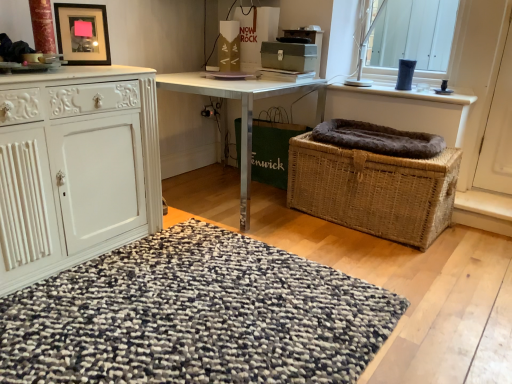
You are a GUI agent. You are given a task and a screenshot of the screen. Output one action in this format:
    pyautogui.click(x=<x>, y=<y>)
    Task: Click on the woven brown picnic basket at lower right
    The width and height of the screenshot is (512, 384).
    Given the screenshot: What is the action you would take?
    pyautogui.click(x=373, y=190)

Where is `woven brown picnic basket at lower right`? Image resolution: width=512 pixels, height=384 pixels. woven brown picnic basket at lower right is located at coordinates (373, 190).

Considering the positions of objects woven brown basket at center and woven brown picnic basket at lower right in the image provided, who is more to the right, woven brown basket at center or woven brown picnic basket at lower right?

woven brown picnic basket at lower right is more to the right.

Considering the positions of point (286, 169) and point (358, 165), is point (286, 169) closer or farther from the camera than point (358, 165)?

Point (286, 169) appears to be farther away from the viewer than point (358, 165).

In the scene shown: From the image's perspective, between woven brown basket at center and woven brown picnic basket at lower right, who is located below?

woven brown picnic basket at lower right, from the image's perspective.

Which of these two, woven brown basket at center or woven brown picnic basket at lower right, stands taller?

woven brown basket at center.

Consider the image. Could you tell me if metallic silver desk at center is facing woven brown picnic basket at lower right?

No, metallic silver desk at center is not turned towards woven brown picnic basket at lower right.

Which point is more forward, (x=246, y=107) or (x=441, y=206)?

Point (x=441, y=206)

Locate an element on the screen. desk that is above the woven brown picnic basket at lower right (from a real-world perspective) is located at coordinates (242, 111).

Does metallic silver desk at center appear on the right side of woven brown picnic basket at lower right?

Incorrect, metallic silver desk at center is not on the right side of woven brown picnic basket at lower right.

In terms of size, does metallic silver desk at center appear bigger or smaller than matte black picture frame at upper left?

Clearly, metallic silver desk at center is larger in size than matte black picture frame at upper left.

I want to click on picture frame above the metallic silver desk at center (from the image's perspective), so click(x=82, y=33).

Which of these two, metallic silver desk at center or matte black picture frame at upper left, stands taller?

metallic silver desk at center.

Which object is positioned more to the left, metallic silver desk at center or textured woolen rug at center?

Positioned to the left is textured woolen rug at center.

Is metallic silver desk at center surrounding textured woolen rug at center?

That's incorrect, textured woolen rug at center is not inside metallic silver desk at center.

From the image's perspective, is metallic silver desk at center under textured woolen rug at center?

Actually, metallic silver desk at center appears above textured woolen rug at center in the image.

Considering the relative sizes of metallic silver desk at center and textured woolen rug at center in the image provided, is metallic silver desk at center taller than textured woolen rug at center?

Indeed, metallic silver desk at center has a greater height compared to textured woolen rug at center.

Considering the relative sizes of woven brown picnic basket at lower right and matte black picture frame at upper left in the image provided, is woven brown picnic basket at lower right smaller than matte black picture frame at upper left?

Actually, woven brown picnic basket at lower right might be larger than matte black picture frame at upper left.

Locate an element on the screen. This screenshot has width=512, height=384. picnic basket below the matte black picture frame at upper left (from a real-world perspective) is located at coordinates (373, 190).

Is woven brown picnic basket at lower right oriented away from matte black picture frame at upper left?

No, woven brown picnic basket at lower right is not facing away from matte black picture frame at upper left.

How far apart are woven brown picnic basket at lower right and matte black picture frame at upper left?

A distance of 1.39 meters exists between woven brown picnic basket at lower right and matte black picture frame at upper left.

Is matte black picture frame at upper left beside woven brown basket at center?

No, matte black picture frame at upper left is not making contact with woven brown basket at center.

How different are the orientations of matte black picture frame at upper left and woven brown basket at center in degrees?

The facing directions of matte black picture frame at upper left and woven brown basket at center are 52.8 degrees apart.

Considering the sizes of objects matte black picture frame at upper left and woven brown basket at center in the image provided, who is thinner, matte black picture frame at upper left or woven brown basket at center?

matte black picture frame at upper left.

Could you tell me if matte black picture frame at upper left is facing woven brown basket at center?

No, matte black picture frame at upper left is not aimed at woven brown basket at center.

From the picture: Is white carved cabinet at left at the back of metallic silver desk at center?

No, metallic silver desk at center's orientation is not away from white carved cabinet at left.

In terms of width, does metallic silver desk at center look wider or thinner when compared to white carved cabinet at left?

Considering their sizes, metallic silver desk at center looks broader than white carved cabinet at left.

From a real-world perspective, who is located higher, metallic silver desk at center or white carved cabinet at left?

From a 3D spatial view, white carved cabinet at left is above.

Who is smaller, metallic silver desk at center or white carved cabinet at left?

With smaller size is white carved cabinet at left.

This screenshot has width=512, height=384. I want to click on picnic basket in front of the woven brown basket at center, so click(x=373, y=190).

Where is `picnic basket on the right side of metallic silver desk at center`? picnic basket on the right side of metallic silver desk at center is located at coordinates (373, 190).

Considering their positions, is matte black picture frame at upper left positioned further to woven brown basket at center than metallic silver desk at center?

matte black picture frame at upper left is further to woven brown basket at center.

Based on their spatial positions, is matte black picture frame at upper left or white carved cabinet at left closer to textured woolen rug at center?

white carved cabinet at left is closer to textured woolen rug at center.

Which object lies nearer to the anchor point white carved cabinet at left, textured woolen rug at center or metallic silver desk at center?

textured woolen rug at center.

Looking at the image, which one is located closer to white carved cabinet at left, matte black picture frame at upper left or textured woolen rug at center?

The object closer to white carved cabinet at left is textured woolen rug at center.

Estimate the real-world distances between objects in this image. Which object is further from matte black picture frame at upper left, white carved cabinet at left or woven brown picnic basket at lower right?

The object further to matte black picture frame at upper left is woven brown picnic basket at lower right.

When comparing their distances from woven brown picnic basket at lower right, does white carved cabinet at left or textured woolen rug at center seem further?

Among the two, white carved cabinet at left is located further to woven brown picnic basket at lower right.

When comparing their distances from white carved cabinet at left, does matte black picture frame at upper left or metallic silver desk at center seem further?

metallic silver desk at center is further to white carved cabinet at left.

Considering their positions, is metallic silver desk at center positioned closer to matte black picture frame at upper left than textured woolen rug at center?

metallic silver desk at center is positioned closer to the anchor matte black picture frame at upper left.

Find the location of `picture frame positioned between textured woolen rug at center and metallic silver desk at center from near to far`. picture frame positioned between textured woolen rug at center and metallic silver desk at center from near to far is located at coordinates (82, 33).

Find the location of a particular element. The image size is (512, 384). basket container situated between metallic silver desk at center and woven brown picnic basket at lower right from left to right is located at coordinates (272, 146).

Locate an element on the screen. picture frame between textured woolen rug at center and woven brown basket at center along the z-axis is located at coordinates (82, 33).

This screenshot has height=384, width=512. In order to click on basket container between white carved cabinet at left and woven brown picnic basket at lower right in this screenshot , I will do `click(272, 146)`.